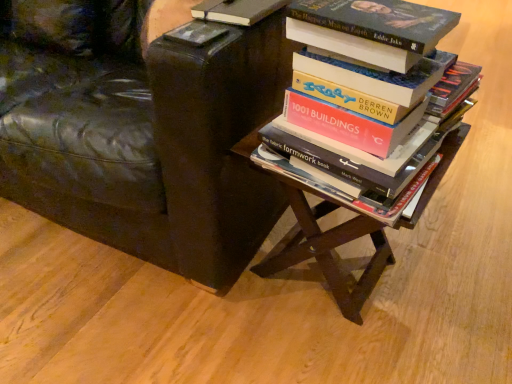
Question: Would you consider wooden table at center to be distant from black leather chair at upper left?

Choices:
 (A) no
 (B) yes

Answer: (A)

Question: Is wooden table at center to the left of black leather chair at upper left from the viewer's perspective?

Choices:
 (A) yes
 (B) no

Answer: (B)

Question: Does wooden table at center have a smaller size compared to black leather chair at upper left?

Choices:
 (A) no
 (B) yes

Answer: (B)

Question: Is wooden table at center oriented towards black leather chair at upper left?

Choices:
 (A) yes
 (B) no

Answer: (B)

Question: From a real-world perspective, is wooden table at center over black leather chair at upper left?

Choices:
 (A) no
 (B) yes

Answer: (A)

Question: Is wooden table at center beside black leather chair at upper left?

Choices:
 (A) no
 (B) yes

Answer: (A)

Question: Is wooden table at center in front of hardcover book at center, the second book in the top-to-bottom sequence?

Choices:
 (A) yes
 (B) no

Answer: (B)

Question: Does wooden table at center turn towards hardcover book at center, the second book in the top-to-bottom sequence?

Choices:
 (A) no
 (B) yes

Answer: (A)

Question: From the image's perspective, is wooden table at center over hardcover book at center, the first book from the bottom?

Choices:
 (A) no
 (B) yes

Answer: (A)

Question: From a real-world perspective, is wooden table at center positioned over hardcover book at center, the second book in the top-to-bottom sequence, based on gravity?

Choices:
 (A) yes
 (B) no

Answer: (B)

Question: Considering the relative positions of wooden table at center and hardcover book at center, the first book from the bottom, in the image provided, is wooden table at center to the left of hardcover book at center, the first book from the bottom, from the viewer's perspective?

Choices:
 (A) no
 (B) yes

Answer: (A)

Question: From the image's perspective, is wooden table at center under hardcover book at center, the second book in the top-to-bottom sequence?

Choices:
 (A) yes
 (B) no

Answer: (A)

Question: Is hardcover book at center, the second book in the top-to-bottom sequence, surrounding black leather chair at upper left?

Choices:
 (A) no
 (B) yes

Answer: (A)